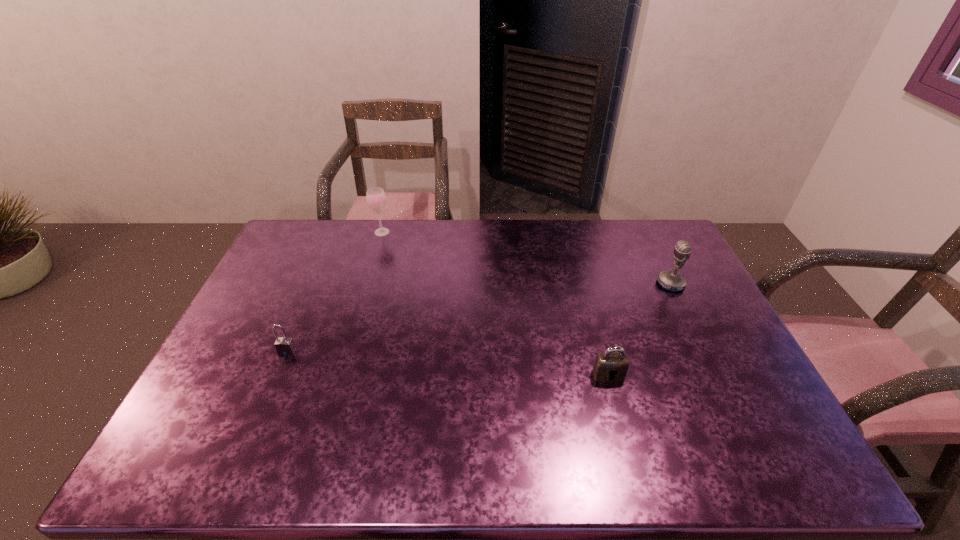
Where is `free space located on the front-facing side of the rightmost object`? This screenshot has height=540, width=960. free space located on the front-facing side of the rightmost object is located at coordinates (593, 284).

You are a GUI agent. You are given a task and a screenshot of the screen. Output one action in this format:
    pyautogui.click(x=<x>, y=<y>)
    Task: Click on the free region located 0.310m on the front-facing side of the rightmost object
    This screenshot has height=540, width=960.
    Given the screenshot: What is the action you would take?
    pyautogui.click(x=564, y=284)

At what (x,y) coordinates should I click in order to perform the action: click on vacant area situated at the front of the third object from left to right near the keyhole. Please return your answer as a coordinate pair (x, y). This screenshot has height=540, width=960. Looking at the image, I should click on (622, 428).

The width and height of the screenshot is (960, 540). What are the coordinates of `vacant space located 0.310m on the shackle of the left padlock` in the screenshot? It's located at (240, 464).

The width and height of the screenshot is (960, 540). In order to click on object positioned at the far edge in this screenshot , I will do `click(376, 198)`.

Identify the location of object that is at the left edge. The width and height of the screenshot is (960, 540). [x=285, y=346].

This screenshot has width=960, height=540. What are the coordinates of `object at the right edge` in the screenshot? It's located at (673, 281).

What are the coordinates of `free space at the far edge` in the screenshot? It's located at (376, 246).

I want to click on vacant area at the near edge, so click(x=660, y=460).

Locate an element on the screen. The height and width of the screenshot is (540, 960). blank space at the left edge of the desktop is located at coordinates (263, 335).